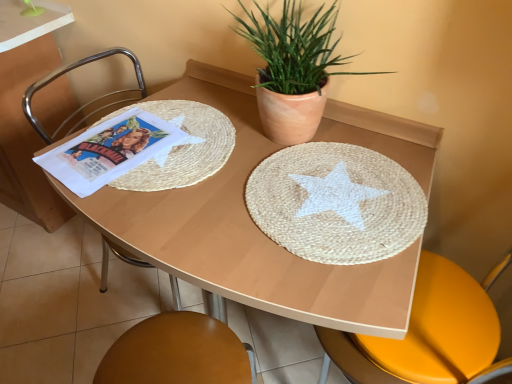
Image resolution: width=512 pixels, height=384 pixels. Find the location of `free space in front of terracotta clay pot at upper center`. free space in front of terracotta clay pot at upper center is located at coordinates (293, 198).